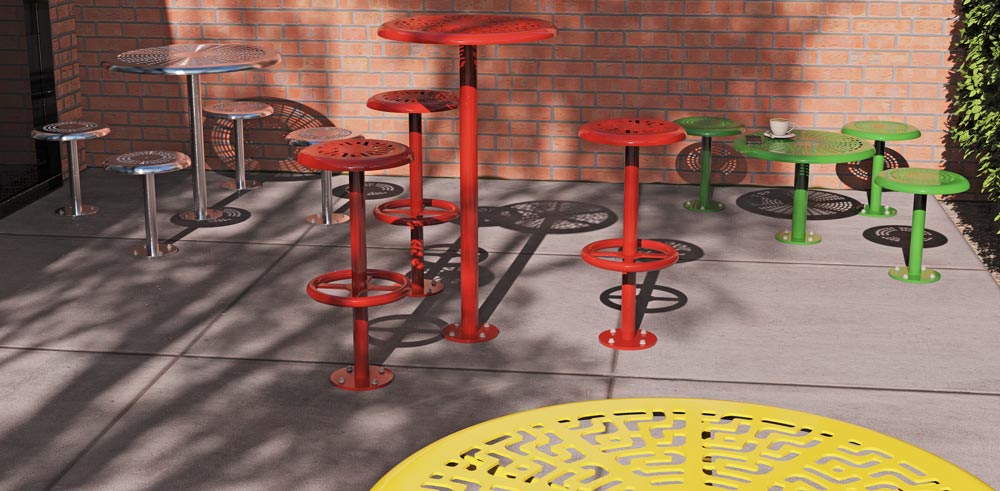
Image resolution: width=1000 pixels, height=491 pixels. Identify the location of green circle table. (816, 157).